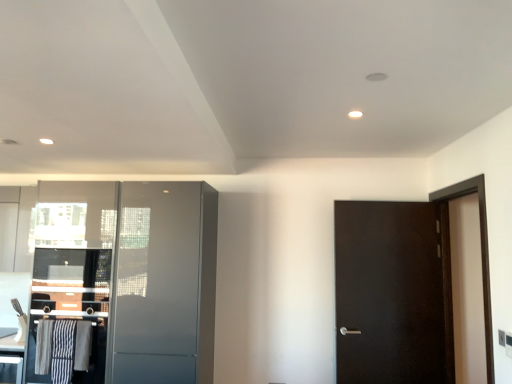
Question: From the image's perspective, is striped fabric laundry at lower left positioned above or below metallic silver cabinet at left, which is the 1th cabinetry in bottom-to-top order?

Choices:
 (A) above
 (B) below

Answer: (A)

Question: Looking at their shapes, would you say striped fabric laundry at lower left is wider or thinner than metallic silver cabinet at left, the 2th cabinetry positioned from the top?

Choices:
 (A) wide
 (B) thin

Answer: (B)

Question: Estimate the real-world distances between objects in this image. Which object is closer to the metallic silver cabinet at left, the 2th cabinetry positioned from the top?

Choices:
 (A) glossy gray cabinet at left, arranged as the 2th cabinetry when ordered from the bottom
 (B) striped fabric laundry at lower left
 (C) satin gray cabinet at left, the first screen door in the left-to-right sequence
 (D) dark wood screen door at right, acting as the 1th screen door starting from the right

Answer: (B)

Question: Which object is positioned farthest from the striped fabric laundry at lower left?

Choices:
 (A) metallic silver cabinet at left, which is the 1th cabinetry in bottom-to-top order
 (B) glossy gray cabinet at left, the first cabinetry viewed from the top
 (C) dark wood screen door at right, acting as the 1th screen door starting from the right
 (D) satin gray cabinet at left, the first screen door in the left-to-right sequence

Answer: (C)